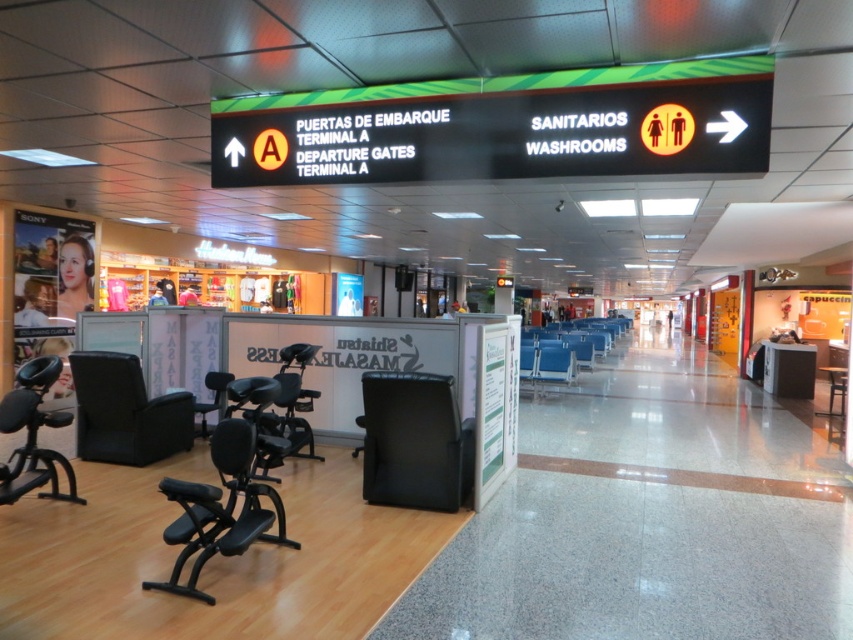
Question: Which of the following is the closest to the observer?

Choices:
 (A) (84, 438)
 (B) (38, 481)
 (C) (376, 483)
 (D) (312, 392)

Answer: (B)

Question: Is black leather chair at lower left in front of metallic blue exercise bike at center?

Choices:
 (A) yes
 (B) no

Answer: (B)

Question: Can you confirm if black matte exercise chair at lower left is smaller than blue fabric chair at center?

Choices:
 (A) yes
 (B) no

Answer: (B)

Question: Which is nearer to the metallic blue exercise bike at center?

Choices:
 (A) blue fabric chair at center
 (B) black leather chair at lower left
 (C) black leather chair at center

Answer: (B)

Question: Estimate the real-world distances between objects in this image. Which object is farther from the black matte exercise chair at lower left?

Choices:
 (A) blue plastic chair at center
 (B) metallic blue exercise bike at center

Answer: (A)

Question: From the image, what is the correct spatial relationship of black leather chair at center in relation to black leather chair at lower left?

Choices:
 (A) right
 (B) left

Answer: (A)